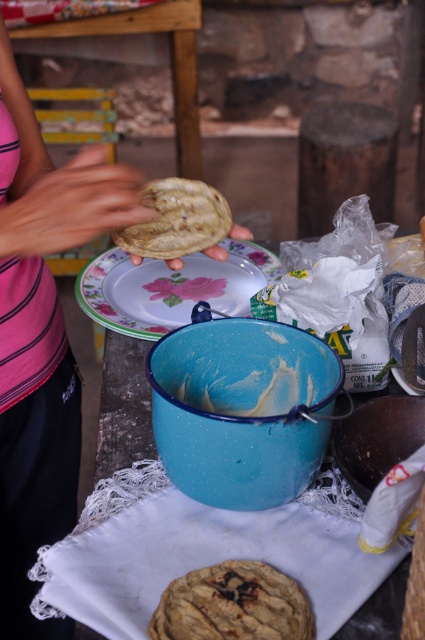
Question: Does white glossy plate at center appear on the left side of pink fabric hand at upper left?

Choices:
 (A) yes
 (B) no

Answer: (B)

Question: Is pink fabric shirt at upper left to the right of pink fabric hand at upper left from the viewer's perspective?

Choices:
 (A) no
 (B) yes

Answer: (A)

Question: Which point is closer to the camera?

Choices:
 (A) golden textured biscuit at center
 (B) pink fabric hand at upper left
 (C) blue enamel bowl at center
 (D) pink fabric shirt at upper left

Answer: (A)

Question: Which of the following is the closest to the observer?

Choices:
 (A) white glossy plate at center
 (B) golden textured biscuit at center

Answer: (B)

Question: Which is farther from the pink fabric hand at upper left?

Choices:
 (A) pink fabric shirt at upper left
 (B) white glossy plate at center
 (C) golden textured biscuit at center

Answer: (C)

Question: Does pink fabric hand at upper left appear under golden textured biscuit at center?

Choices:
 (A) no
 (B) yes

Answer: (A)